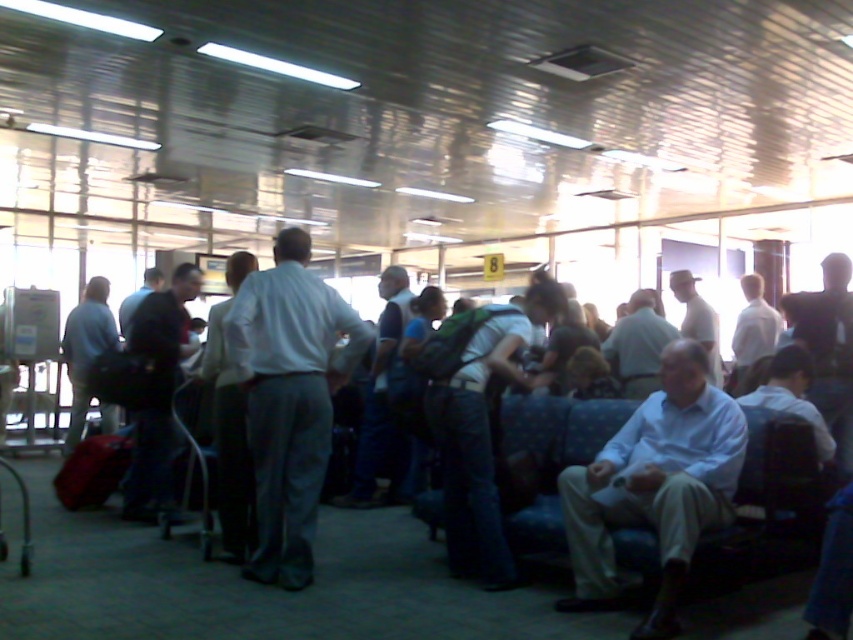
Question: Which point is closer to the camera taking this photo?

Choices:
 (A) (633, 445)
 (B) (90, 278)

Answer: (A)

Question: Observing the image, what is the correct spatial positioning of white shirt at center in reference to light blue shirt at center?

Choices:
 (A) right
 (B) left

Answer: (A)

Question: Is white shirt at center below light blue shirt at center?

Choices:
 (A) yes
 (B) no

Answer: (A)

Question: Which point is farther from the camera taking this photo?

Choices:
 (A) (74, 362)
 (B) (680, 486)

Answer: (A)

Question: Can you confirm if white shirt at center is wider than light blue shirt at center?

Choices:
 (A) no
 (B) yes

Answer: (A)

Question: Which point appears closest to the camera in this image?

Choices:
 (A) (73, 404)
 (B) (564, 468)

Answer: (B)